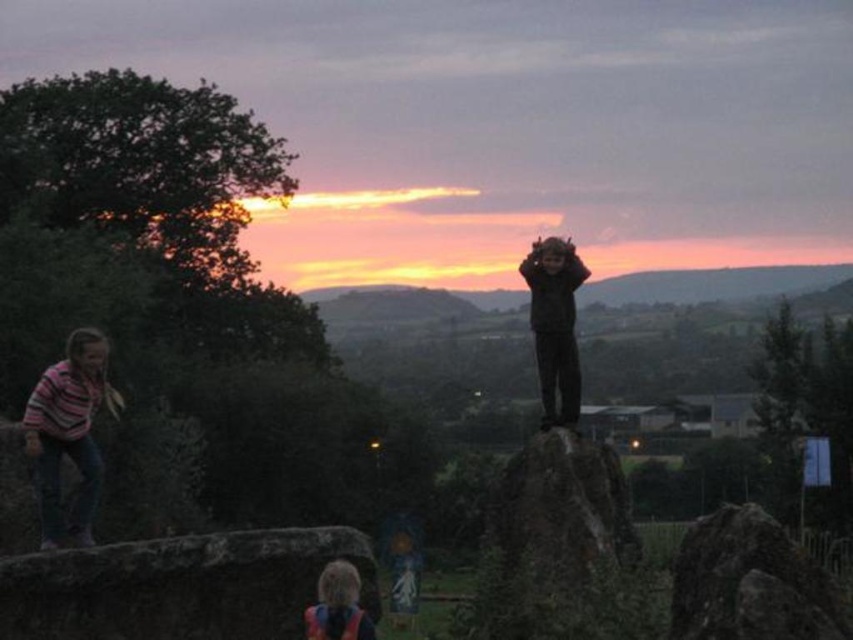
Question: Is dark gray hoodie at center to the left of orange safety vest at lower center from the viewer's perspective?

Choices:
 (A) no
 (B) yes

Answer: (A)

Question: Is rough stone boulder at center above orange safety vest at lower center?

Choices:
 (A) yes
 (B) no

Answer: (A)

Question: Which object appears closest to the camera in this image?

Choices:
 (A) striped sweater at left
 (B) rough stone boulder at center

Answer: (B)

Question: Among these points, which one is farthest from the camera?

Choices:
 (A) (737, 612)
 (B) (569, 346)

Answer: (B)

Question: Which point appears closest to the camera in this image?

Choices:
 (A) (689, 554)
 (B) (325, 624)
 (C) (577, 275)
 (D) (65, 374)

Answer: (A)

Question: Does striped sweater at left appear under orange safety vest at lower center?

Choices:
 (A) yes
 (B) no

Answer: (B)